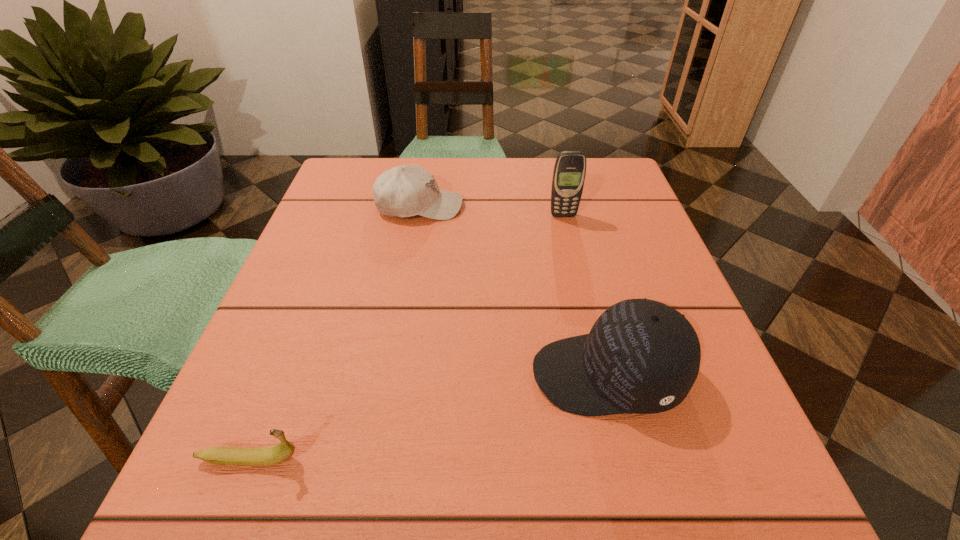
The height and width of the screenshot is (540, 960). I want to click on object at the near left corner, so click(221, 455).

Locate an element on the screen. Image resolution: width=960 pixels, height=540 pixels. vacant point at the far edge is located at coordinates click(436, 171).

Find the location of `vacant space at the near edge of the desktop`. vacant space at the near edge of the desktop is located at coordinates (564, 522).

Where is `vacant space at the left edge of the desktop`? The height and width of the screenshot is (540, 960). vacant space at the left edge of the desktop is located at coordinates (338, 219).

The image size is (960, 540). I want to click on vacant space at the right edge of the desktop, so point(645,272).

You are a GUI agent. You are given a task and a screenshot of the screen. Output one action in this format:
    pyautogui.click(x=<x>, y=<y>)
    Task: Click on the free space at the far left corner
    
    Given the screenshot: What is the action you would take?
    pyautogui.click(x=361, y=191)

Locate an element on the screen. vacant space at the far right corner of the desktop is located at coordinates (621, 177).

I want to click on free space between the left baseball cap and the tallest object, so click(492, 211).

Locate an element on the screen. This screenshot has width=960, height=540. empty space between the nearer baseball cap and the tallest object is located at coordinates (586, 295).

This screenshot has width=960, height=540. What are the coordinates of `free spot between the second shortest object and the taller baseball cap` in the screenshot? It's located at (514, 291).